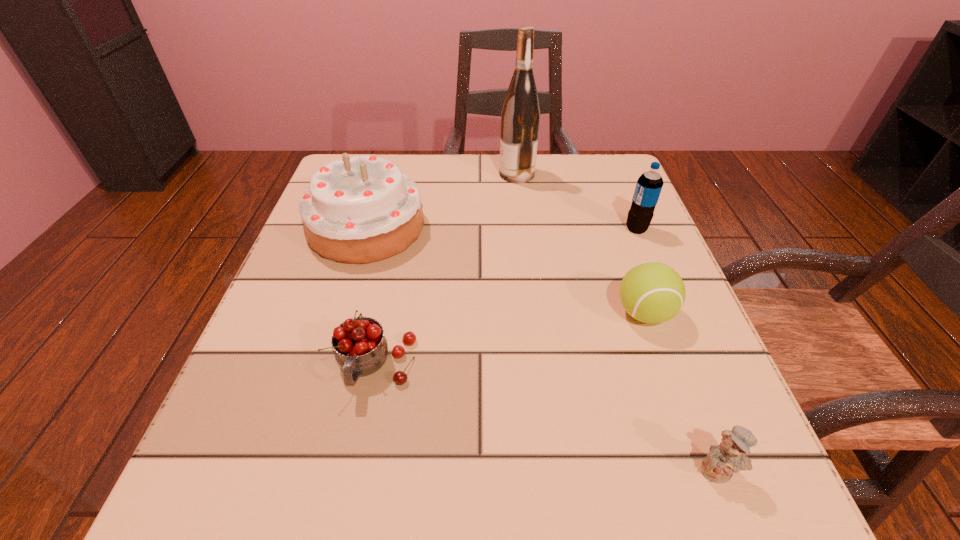
Identify the location of vacant area between the cake and the tennis ball. (506, 271).

Identify the location of vacant space that's between the tallest object and the teddy bear. (617, 322).

The width and height of the screenshot is (960, 540). Identify the location of free space that is in between the cherry and the wine bottle. (446, 270).

The image size is (960, 540). I want to click on free space between the cake and the soda bottle, so click(502, 228).

Locate an element on the screen. The height and width of the screenshot is (540, 960). free space that is in between the cake and the tennis ball is located at coordinates (506, 271).

Find the location of a particular element. This screenshot has height=540, width=960. unoccupied position between the third object from left to right and the cherry is located at coordinates (446, 270).

Identify which object is the third nearest to the tennis ball. Please provide its 2D coordinates. Your answer should be formatted as a tuple, i.e. [(x, y)], where the tuple contains the x and y coordinates of a point satisfying the conditions above.

[(360, 347)]

Where is `object that is the nearest to the tennis ball`? object that is the nearest to the tennis ball is located at coordinates (649, 185).